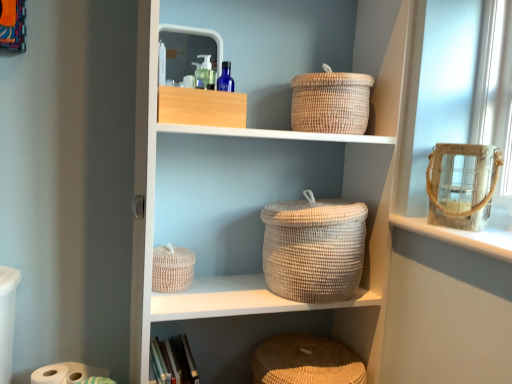
Question: From a real-world perspective, is natural woven basket at lower center, the 1th basket in the bottom-to-top sequence, positioned over orange fabric picture frame at upper left based on gravity?

Choices:
 (A) no
 (B) yes

Answer: (A)

Question: Is natural woven basket at lower center, which appears as the 3th basket when viewed from the top, to the left of orange fabric picture frame at upper left from the viewer's perspective?

Choices:
 (A) yes
 (B) no

Answer: (B)

Question: Can we say natural woven basket at lower center, which appears as the 3th basket when viewed from the top, lies outside orange fabric picture frame at upper left?

Choices:
 (A) yes
 (B) no

Answer: (A)

Question: Could you tell me if natural woven basket at lower center, which appears as the 3th basket when viewed from the top, is turned towards orange fabric picture frame at upper left?

Choices:
 (A) no
 (B) yes

Answer: (A)

Question: From a real-world perspective, is natural woven basket at lower center, the 1th basket in the bottom-to-top sequence, located beneath orange fabric picture frame at upper left?

Choices:
 (A) yes
 (B) no

Answer: (A)

Question: Considering the positions of natural woven basket at center, the second basket when ordered from bottom to top, and white woven basket at center in the image, is natural woven basket at center, the second basket when ordered from bottom to top, taller or shorter than white woven basket at center?

Choices:
 (A) tall
 (B) short

Answer: (B)

Question: Based on their sizes in the image, would you say natural woven basket at center, the second basket when ordered from bottom to top, is bigger or smaller than white woven basket at center?

Choices:
 (A) big
 (B) small

Answer: (B)

Question: Is natural woven basket at center, the 2th basket when ordered from top to bottom, to the left or to the right of white woven basket at center in the image?

Choices:
 (A) right
 (B) left

Answer: (B)

Question: Is point (173, 251) positioned closer to the camera than point (322, 223)?

Choices:
 (A) farther
 (B) closer

Answer: (A)

Question: In the image, is natural woven basket at center, the 2th basket when ordered from top to bottom, positioned in front of or behind orange fabric picture frame at upper left?

Choices:
 (A) behind
 (B) front

Answer: (A)

Question: Is natural woven basket at center, the 2th basket when ordered from top to bottom, to the left or to the right of orange fabric picture frame at upper left in the image?

Choices:
 (A) left
 (B) right

Answer: (B)

Question: Is natural woven basket at center, the 2th basket when ordered from top to bottom, wider or thinner than orange fabric picture frame at upper left?

Choices:
 (A) wide
 (B) thin

Answer: (A)

Question: Considering the positions of point (159, 291) and point (7, 24), is point (159, 291) closer or farther from the camera than point (7, 24)?

Choices:
 (A) farther
 (B) closer

Answer: (A)

Question: Would you say natural woven baskets at center is inside or outside natural woven basket at upper center, the 1th basket viewed from the top?

Choices:
 (A) inside
 (B) outside

Answer: (B)

Question: Considering the positions of natural woven baskets at center and natural woven basket at upper center, the 3th basket in the bottom-to-top sequence, in the image, is natural woven baskets at center bigger or smaller than natural woven basket at upper center, the 3th basket in the bottom-to-top sequence,?

Choices:
 (A) small
 (B) big

Answer: (B)